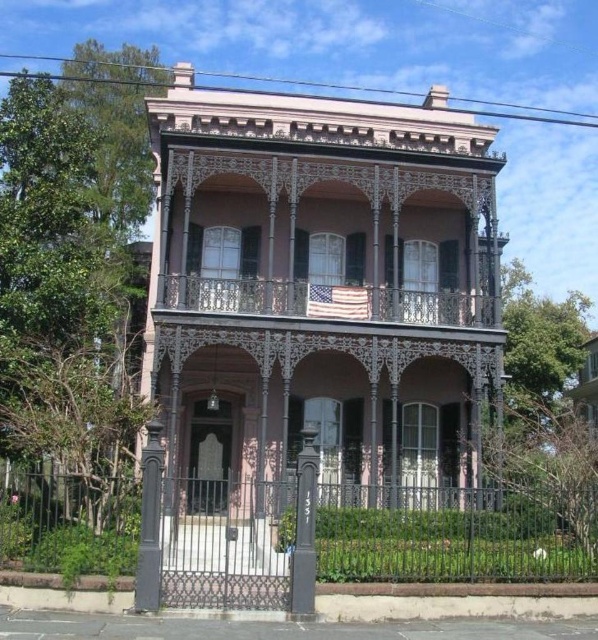
Is black wrought iron gate at center below black polished metal post at center?

Yes.

Looking at this image, who is shorter, black wrought iron gate at center or black polished metal post at center?

black wrought iron gate at center is shorter.

Which is in front, point (511, 572) or point (309, 481)?

Point (309, 481)

Identify the location of black wrought iron gate at center. This screenshot has width=598, height=640. (443, 540).

Between point (242, 605) and point (157, 550), which one is positioned in front?

Point (242, 605) is more forward.

Where is `black wrought iron gate at center`? black wrought iron gate at center is located at coordinates (443, 540).

Can you confirm if black wrought iron post at lower left is positioned to the left of black polished metal post at center?

Indeed, black wrought iron post at lower left is positioned on the left side of black polished metal post at center.

How far apart are black wrought iron post at lower left and black polished metal post at center?

A distance of 6.33 meters exists between black wrought iron post at lower left and black polished metal post at center.

Where is `black wrought iron post at lower left`? The width and height of the screenshot is (598, 640). black wrought iron post at lower left is located at coordinates (150, 524).

Find the location of a particular element. black wrought iron post at lower left is located at coordinates (150, 524).